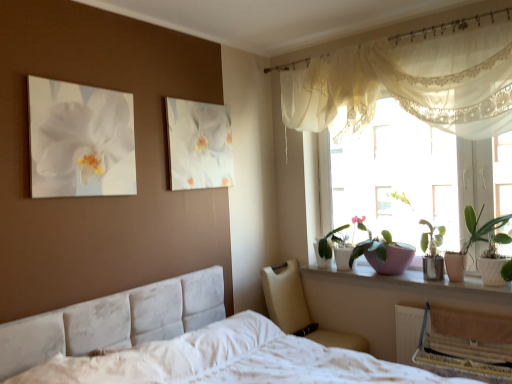
Question: From the image's perspective, is sheer white curtain at upper right under green glossy plant at right, the first houseplant from the right?

Choices:
 (A) no
 (B) yes

Answer: (A)

Question: Does sheer white curtain at upper right have a lesser height compared to green glossy plant at right, which is counted as the second houseplant, starting from the back?

Choices:
 (A) yes
 (B) no

Answer: (B)

Question: Does sheer white curtain at upper right have a smaller size compared to green glossy plant at right, the first houseplant from the right?

Choices:
 (A) no
 (B) yes

Answer: (A)

Question: Is sheer white curtain at upper right oriented towards green glossy plant at right, the first houseplant from the right?

Choices:
 (A) no
 (B) yes

Answer: (A)

Question: Is sheer white curtain at upper right to the right of green glossy plant at right, which is counted as the second houseplant, starting from the back, from the viewer's perspective?

Choices:
 (A) yes
 (B) no

Answer: (B)

Question: Is sheer white curtain at upper right behind green glossy plant at right, the first houseplant from the right?

Choices:
 (A) yes
 (B) no

Answer: (B)

Question: From the image's perspective, is green glossy leafy plant at window, positioned as the 2th houseplant in right-to-left order, under white glossy bowl at upper right?

Choices:
 (A) no
 (B) yes

Answer: (A)

Question: Is green glossy leafy plant at window, positioned as the 2th houseplant in right-to-left order, shorter than white glossy bowl at upper right?

Choices:
 (A) yes
 (B) no

Answer: (B)

Question: Does green glossy leafy plant at window, acting as the first houseplant starting from the left, appear on the left side of white glossy bowl at upper right?

Choices:
 (A) no
 (B) yes

Answer: (B)

Question: Does green glossy leafy plant at window, acting as the first houseplant starting from the left, have a smaller size compared to white glossy bowl at upper right?

Choices:
 (A) yes
 (B) no

Answer: (B)

Question: Is green glossy leafy plant at window, which ranks as the 2th houseplant in front-to-back order, completely or partially outside of white glossy bowl at upper right?

Choices:
 (A) yes
 (B) no

Answer: (A)

Question: Is green glossy leafy plant at window, acting as the first houseplant starting from the left, further to the viewer compared to white glossy bowl at upper right?

Choices:
 (A) no
 (B) yes

Answer: (B)

Question: Is sheer white curtain at upper right oriented towards white glossy bowl at upper right?

Choices:
 (A) no
 (B) yes

Answer: (A)